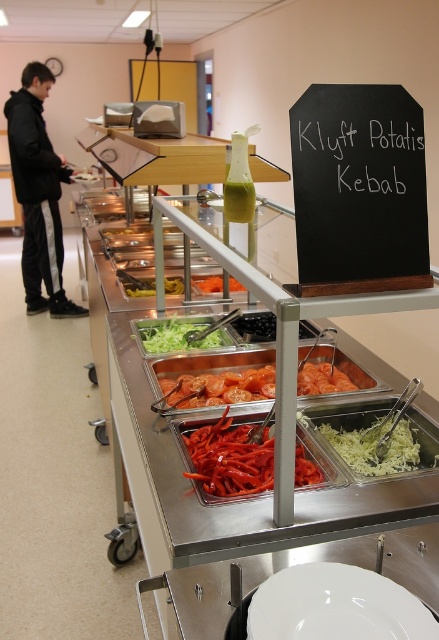
Who is lower down, bright red sliced pepper at center or shiny orange slices at center?

Positioned lower is bright red sliced pepper at center.

Does point (309, 465) come closer to viewer compared to point (207, 387)?

Yes, it is in front of point (207, 387).

Image resolution: width=439 pixels, height=640 pixels. What are the coordinates of `bright red sliced pepper at center` in the screenshot? It's located at (230, 458).

Who is shorter, black chalkboard at upper center or black glossy grapes at center?

black glossy grapes at center is shorter.

Consider the image. Who is lower down, black chalkboard at upper center or black glossy grapes at center?

black glossy grapes at center is below.

You are a GUI agent. You are given a task and a screenshot of the screen. Output one action in this format:
    pyautogui.click(x=<x>, y=<y>)
    Task: Click on the black chalkboard at upper center
    
    Given the screenshot: What is the action you would take?
    pyautogui.click(x=359, y=189)

Between black chalkboard at upper center and green matte vegetable at center, which one appears on the right side from the viewer's perspective?

black chalkboard at upper center

Looking at this image, is black chalkboard at upper center smaller than green matte vegetable at center?

No, black chalkboard at upper center is not smaller than green matte vegetable at center.

Does point (373, 129) come in front of point (129, 284)?

Yes, point (373, 129) is in front of point (129, 284).

Locate an element on the screen. The height and width of the screenshot is (640, 439). black chalkboard at upper center is located at coordinates (359, 189).